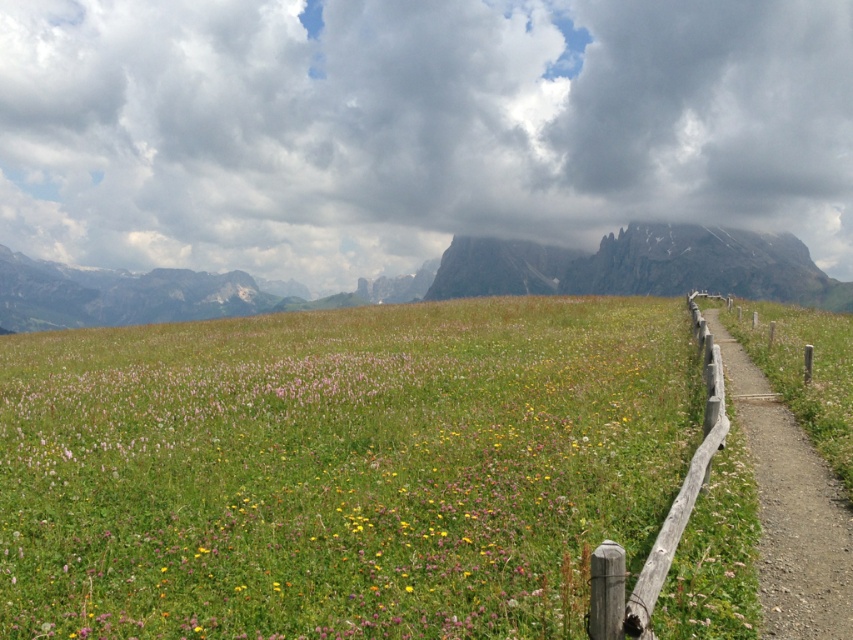
From the picture: You are a hiker standing on the dirt path in the alpine meadow. You want to take a shortcut to the wooden fence at right. Which direction should you walk relative to the green grassy field at center?

You should walk to the right of the green grassy field at center to reach the wooden fence at right since the wooden fence at right is positioned on the right side of the green grassy field at center.

You are standing in the meadow and want to take a photo of the wooden fence at right without the green grassy field at center appearing in the background. Is this possible?

The green grassy field at center is in front of the wooden fence at right, so you cannot take a photo of the wooden fence at right without the green grassy field at center appearing in the background.

You are standing at the starting point of the dirt path in the meadow. You see two points marked in the image. Which point is closer to you, point (84, 442) or point (822, 532)?

Point (822, 532) is closer to you because it is in front of point (84, 442).